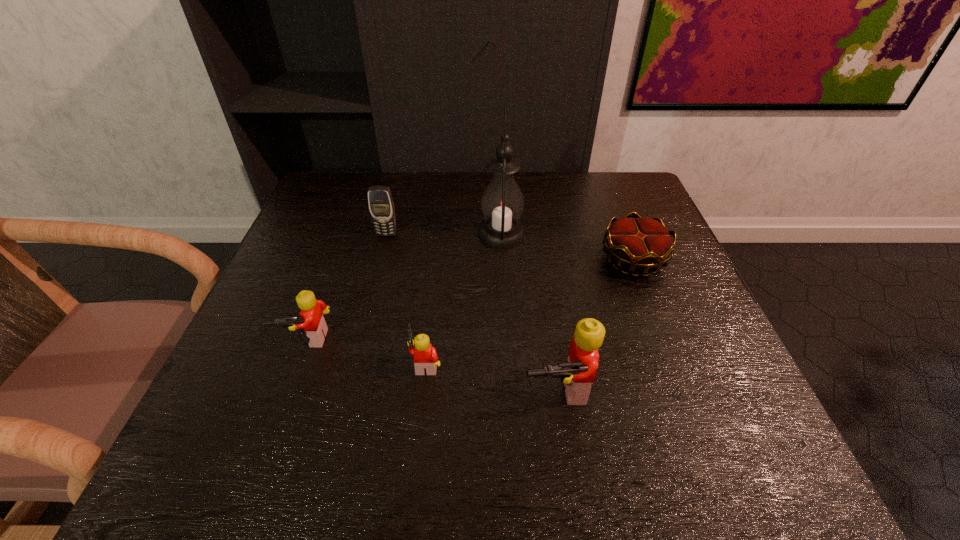
Please point a spot on the right to add another Lego. Please provide its 2D coordinates. Your answer should be formatted as a tuple, i.e. [(x, y)], where the tuple contains the x and y coordinates of a point satisfying the conditions above.

[(704, 420)]